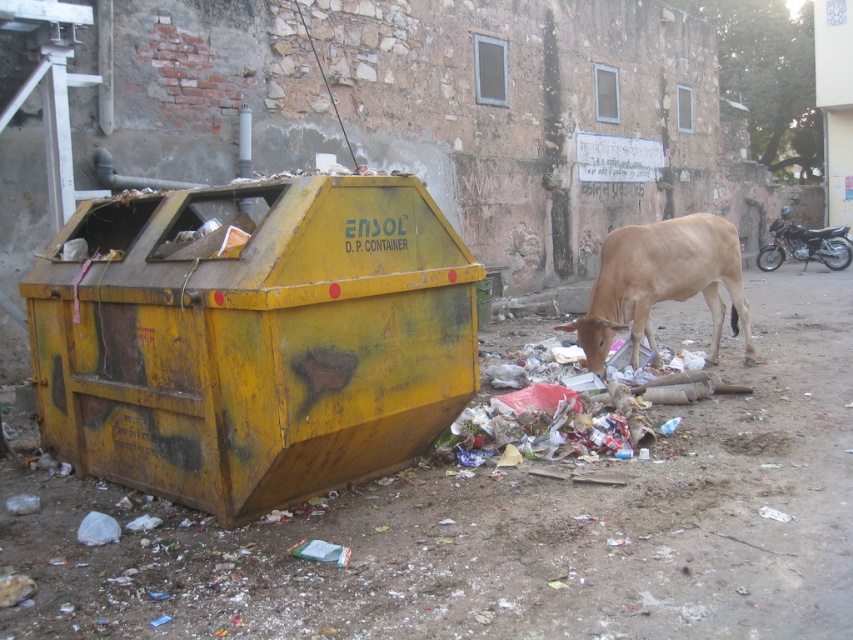
Between yellow matte container at left and light brown cow at center, which one has more height?

yellow matte container at left

The width and height of the screenshot is (853, 640). What do you see at coordinates (253, 339) in the screenshot?
I see `yellow matte container at left` at bounding box center [253, 339].

Is point (144, 323) positioned behind point (648, 307)?

No, it is in front of (648, 307).

What are the coordinates of `yellow matte container at left` in the screenshot? It's located at (253, 339).